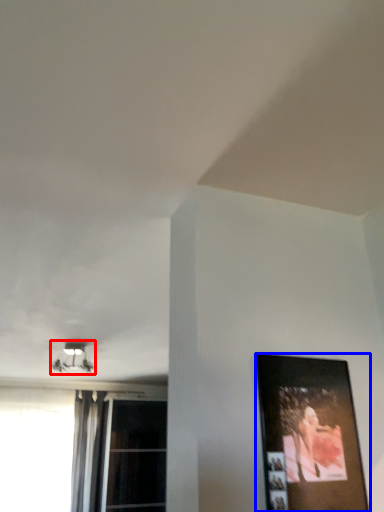
Question: Which point is further to the camera, lamp (highlighted by a red box) or picture frame (highlighted by a blue box)?

Choices:
 (A) lamp
 (B) picture frame

Answer: (A)